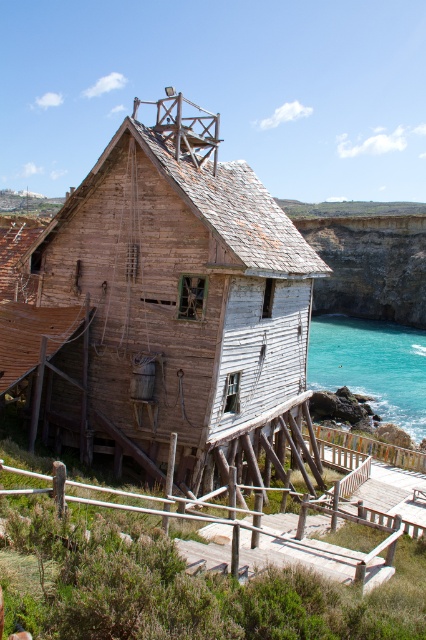
You are standing in front of the rustic wooden structure and want to determine the relative positions of two points marked on the building. Which of the two points, point 1 at coordinates point (115,257) or point 2 at coordinates point (382,349), is closer to your viewpoint?

Point 1 at coordinates point (115,257) is closer to the camera than point 2 at coordinates point (382,349).

You are standing on the observation deck of the rustic wooden structure and want to look down at the rugged stone cliff at right and the turquoise water at lower right. Which one is higher from your current position?

The rugged stone cliff at right is much taller than the turquoise water at lower right, so from your current position on the observation deck, the rugged stone cliff at right is higher than the turquoise water at lower right.

You are planning to build a small garden between the weathered wood hut at center and the rugged stone cliff at right. Given their widths, which structure should you place closer to the middle of the area to ensure the garden is balanced?

Since the weathered wood hut at center is narrower than the rugged stone cliff at right, you should place the weathered wood hut at center closer to the middle to balance the garden layout.